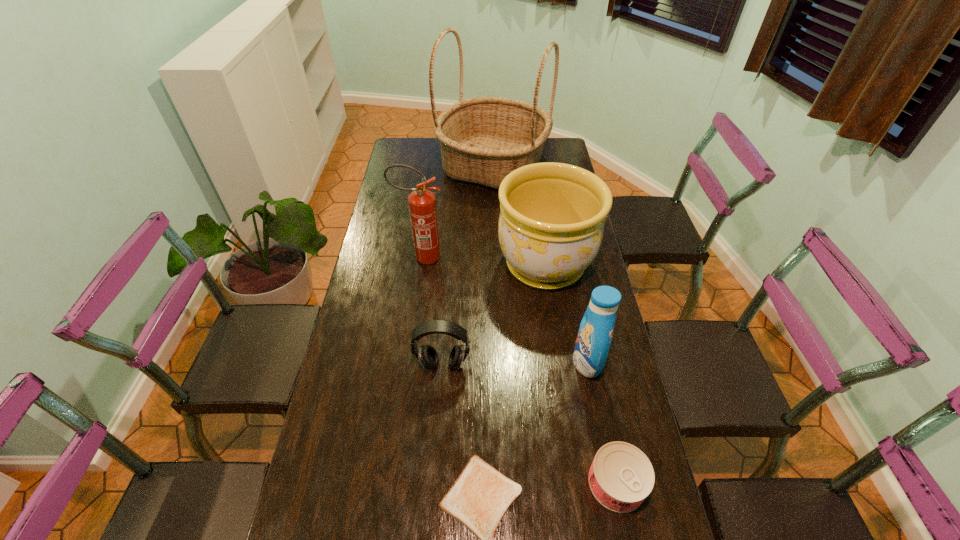
At what (x,y) coordinates should I click in order to perform the action: click on the farthest object. Please return your answer as a coordinate pair (x, y). The height and width of the screenshot is (540, 960). Looking at the image, I should click on (482, 139).

Locate an element on the screen. The height and width of the screenshot is (540, 960). basket is located at coordinates (482, 139).

What are the coordinates of `fire extinguisher` in the screenshot? It's located at (422, 204).

Where is `flowerpot`? The image size is (960, 540). flowerpot is located at coordinates (552, 215).

At what (x,y) coordinates should I click in order to perform the action: click on detergent. Please return your answer as a coordinate pair (x, y). This screenshot has height=540, width=960. Looking at the image, I should click on (595, 333).

You are a GUI agent. You are given a task and a screenshot of the screen. Output one action in this format:
    pyautogui.click(x=<x>, y=<y>)
    Task: Click on the fifth tallest object
    The image size is (960, 540).
    Given the screenshot: What is the action you would take?
    pyautogui.click(x=427, y=355)

Identify the location of the second shortest object. Image resolution: width=960 pixels, height=540 pixels. (621, 476).

Find the location of a particular element. This screenshot has height=540, width=960. free spot located on the front of the tallest object is located at coordinates (494, 213).

Locate an element on the screen. Image resolution: width=960 pixels, height=540 pixels. vacant space located 0.250m from the nozzle of the second tallest object is located at coordinates (514, 257).

Where is `vacant space located on the back of the flowerpot`? The width and height of the screenshot is (960, 540). vacant space located on the back of the flowerpot is located at coordinates (534, 187).